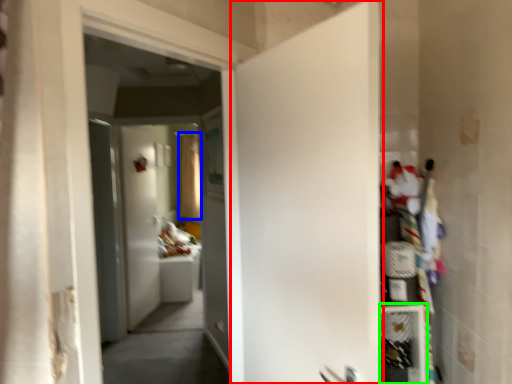
Question: Based on their relative distances, which object is farther from door (highlighted by a red box)? Choose from curtain (highlighted by a blue box) and shelf (highlighted by a green box).

Choices:
 (A) curtain
 (B) shelf

Answer: (A)